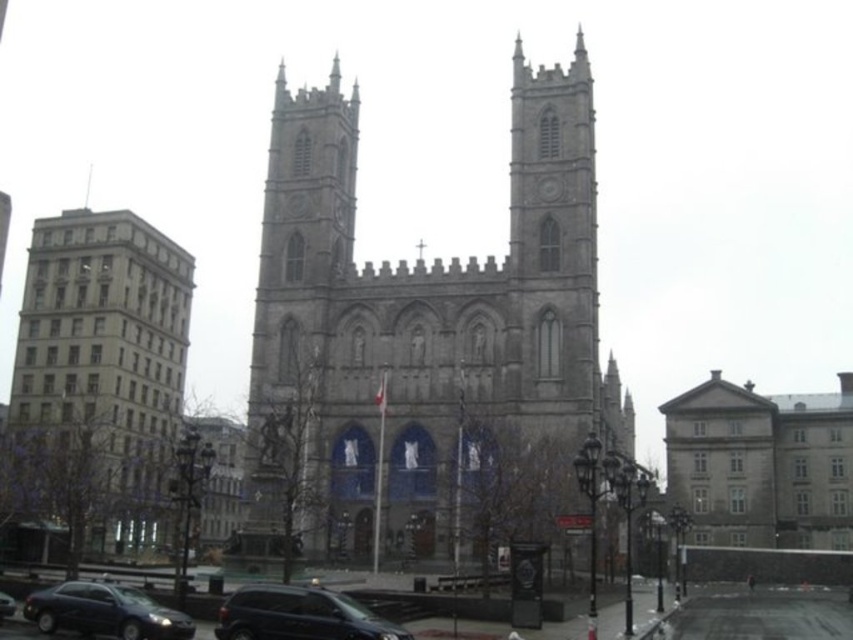
Consider the image. Does gray stone church at right appear on the left side of matte black sedan at lower left?

No, gray stone church at right is not to the left of matte black sedan at lower left.

Can you confirm if gray stone church at right is thinner than matte black sedan at lower left?

Incorrect, gray stone church at right's width is not less than matte black sedan at lower left's.

Who is more distant from viewer, (764, 397) or (74, 625)?

Positioned behind is point (764, 397).

Where is `gray stone church at right`? Image resolution: width=853 pixels, height=640 pixels. gray stone church at right is located at coordinates (761, 465).

Is the position of gray stone church at right less distant than that of shiny black suv at center?

No.

Is point (720, 518) farther from camera compared to point (239, 604)?

Yes.

Find the location of a particular element. Image resolution: width=853 pixels, height=640 pixels. gray stone church at right is located at coordinates (761, 465).

Can you confirm if gray stone church at center is wider than gray concrete building at left?

Yes.

Is gray stone church at center behind gray concrete building at left?

No, it is not.

Between point (509, 312) and point (184, 332), which one is positioned behind?

The point (184, 332) is behind.

Identify the location of gray stone church at center. (427, 314).